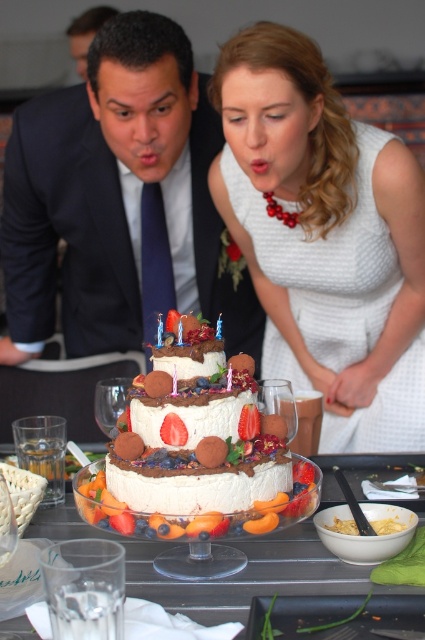
Who is taller, white textured dress at center or white frosted cake at center?

white textured dress at center is taller.

Where is `white textured dress at center`? This screenshot has width=425, height=640. white textured dress at center is located at coordinates coord(325,237).

Based on the photo, is white frosted cake at center thinner than white glossy cake at center?

Yes, white frosted cake at center is thinner than white glossy cake at center.

Is point (283, 476) farther from viewer compared to point (260, 536)?

That is True.

Identify the location of white frosted cake at center. This screenshot has width=425, height=640. (198, 449).

Locate an element on the screen. This screenshot has height=640, width=425. white textured dress at center is located at coordinates (325, 237).